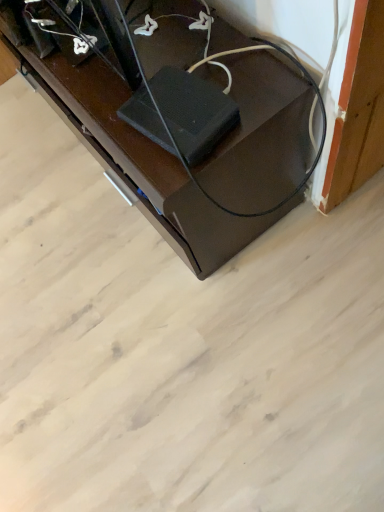
Question: Should I look upward or downward to see black glossy speaker at lower right?

Choices:
 (A) down
 (B) up

Answer: (B)

Question: Is black rubber speaker at center not close to black glossy speaker at lower right?

Choices:
 (A) yes
 (B) no

Answer: (B)

Question: From a real-world perspective, is black rubber speaker at center positioned under black glossy speaker at lower right based on gravity?

Choices:
 (A) no
 (B) yes

Answer: (A)

Question: Does black rubber speaker at center have a lesser height compared to black glossy speaker at lower right?

Choices:
 (A) no
 (B) yes

Answer: (B)

Question: From the image's perspective, is black rubber speaker at center under black glossy speaker at lower right?

Choices:
 (A) yes
 (B) no

Answer: (A)

Question: Are black rubber speaker at center and black glossy speaker at lower right making contact?

Choices:
 (A) no
 (B) yes

Answer: (A)

Question: Is the depth of black rubber speaker at center greater than that of black glossy speaker at lower right?

Choices:
 (A) yes
 (B) no

Answer: (B)

Question: Is black glossy speaker at lower right completely or partially outside of black rubber speaker at center?

Choices:
 (A) no
 (B) yes

Answer: (B)

Question: From a real-world perspective, is black glossy speaker at lower right physically above black rubber speaker at center?

Choices:
 (A) no
 (B) yes

Answer: (A)

Question: Is black glossy speaker at lower right positioned with its back to black rubber speaker at center?

Choices:
 (A) no
 (B) yes

Answer: (A)

Question: From the image's perspective, does black glossy speaker at lower right appear lower than black rubber speaker at center?

Choices:
 (A) no
 (B) yes

Answer: (A)

Question: Could black rubber speaker at center be considered to be inside black glossy speaker at lower right?

Choices:
 (A) yes
 (B) no

Answer: (B)

Question: Can you confirm if black glossy speaker at lower right is positioned to the left of black rubber speaker at center?

Choices:
 (A) yes
 (B) no

Answer: (A)

Question: From a real-world perspective, is black glossy speaker at lower right positioned above or below black rubber speaker at center?

Choices:
 (A) above
 (B) below

Answer: (B)